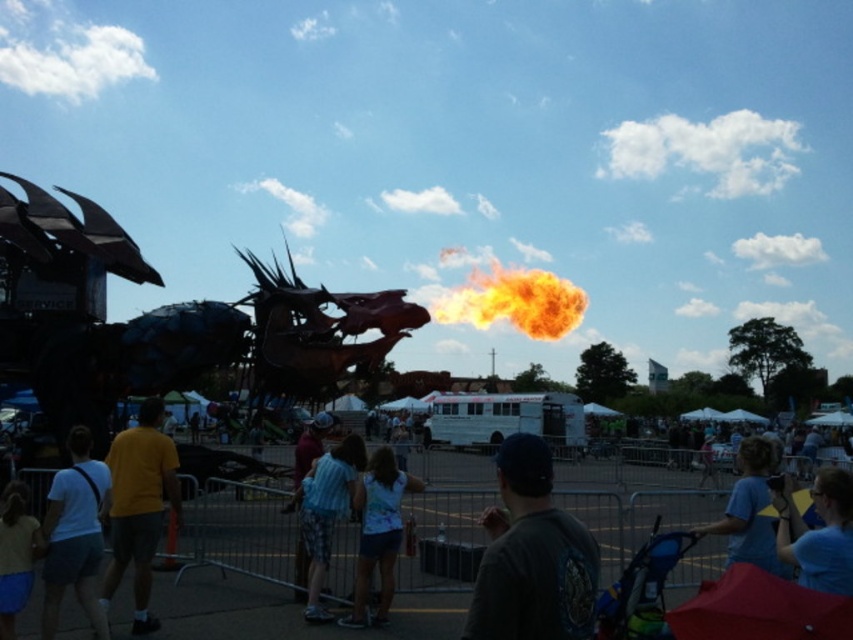
You are a photographer positioned at the center of the event. You want to capture a photo of the flame at center without including the dragon structure on the left. Is the dragon structure blocking your shot? Please explain using coordinates.

The flame at center is located at coordinates point (x=514, y=301). Since the dragon structure is on the left side of the frame, its position would be to the left of the flame. Therefore, the dragon structure is not blocking the flame at center in your shot.

You are standing at the event and want to take a photo of the dragon structure. The camera you have can focus on objects up to 200 feet away. Is the point at coordinates point [42,605] within the camera focus range?

The point at coordinates point [42,605] is 183.54 feet from the viewer, which is within the camera focus range of up to 200 feet. Yes, the camera can focus on it.

You are a guest at the event and want to take a photo of the flame at center and the striped shirt at center in the same frame. Given that your camera has a maximum focus range of 150 meters, will you be able to capture both objects in focus simultaneously?

The flame at center is 147.94 meters from the striped shirt at center. Since the distance between them is within the camera maximum focus range of 150 meters, you can capture both in focus.